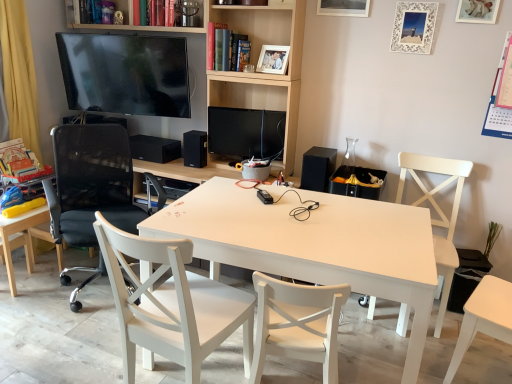
Question: Is the position of black matte speaker at upper right, the third speaker from the left, less distant than that of yellow fabric chair at left, the 5th chair when ordered from right to left?

Choices:
 (A) yes
 (B) no

Answer: (B)

Question: Considering the relative sizes of black matte speaker at upper right, the 1th speaker when ordered from right to left, and yellow fabric chair at left, the 1th chair positioned from the left, in the image provided, is black matte speaker at upper right, the 1th speaker when ordered from right to left, bigger than yellow fabric chair at left, the 1th chair positioned from the left,?

Choices:
 (A) yes
 (B) no

Answer: (B)

Question: Is black matte speaker at upper right, which is the third speaker in back-to-front order, completely or partially outside of yellow fabric chair at left, the 1th chair positioned from the left?

Choices:
 (A) no
 (B) yes

Answer: (B)

Question: Is black matte speaker at upper right, the 1th speaker when ordered from right to left, to the left of yellow fabric chair at left, the 1th chair positioned from the left, from the viewer's perspective?

Choices:
 (A) yes
 (B) no

Answer: (B)

Question: From the image's perspective, would you say black matte speaker at upper right, the 1th speaker when ordered from right to left, is shown under yellow fabric chair at left, the 5th chair when ordered from right to left?

Choices:
 (A) no
 (B) yes

Answer: (A)

Question: In terms of width, does black matte speaker at upper right, which is the third speaker in back-to-front order, look wider or thinner when compared to hardcover book at upper center, placed as the 1th book when sorted from left to right?

Choices:
 (A) thin
 (B) wide

Answer: (B)

Question: In terms of height, does black matte speaker at upper right, which is the third speaker in back-to-front order, look taller or shorter compared to hardcover book at upper center, the 2th book when ordered from bottom to top?

Choices:
 (A) short
 (B) tall

Answer: (A)

Question: From the image's perspective, is black matte speaker at upper right, marked as the 1th speaker in a front-to-back arrangement, above or below hardcover book at upper center, which is the 1th book in top-to-bottom order?

Choices:
 (A) below
 (B) above

Answer: (A)

Question: Relative to hardcover book at upper center, placed as the 1th book when sorted from left to right, is black matte speaker at upper right, which is the third speaker in back-to-front order, in front or behind?

Choices:
 (A) front
 (B) behind

Answer: (A)

Question: From a real-world perspective, is white wood chair at right, marked as the first chair in a right-to-left arrangement, physically located above or below white matte picture frame at upper center, the second picture frame viewed from the left?

Choices:
 (A) below
 (B) above

Answer: (A)

Question: Is white wood chair at right, acting as the fifth chair starting from the left, to the left or to the right of white matte picture frame at upper center, which appears as the 3th picture frame when viewed from the right, in the image?

Choices:
 (A) left
 (B) right

Answer: (B)

Question: Does point (455, 253) appear closer or farther from the camera than point (316, 6)?

Choices:
 (A) closer
 (B) farther

Answer: (A)

Question: In the image, is white wood chair at right, acting as the fifth chair starting from the left, positioned in front of or behind white matte picture frame at upper center, the second picture frame viewed from the left?

Choices:
 (A) behind
 (B) front

Answer: (B)

Question: In terms of size, does white matte table at center appear bigger or smaller than white lace picture frame at upper right, marked as the second picture frame in a right-to-left arrangement?

Choices:
 (A) big
 (B) small

Answer: (A)

Question: From the image's perspective, is white matte table at center above or below white lace picture frame at upper right, placed as the third picture frame when sorted from left to right?

Choices:
 (A) above
 (B) below

Answer: (B)